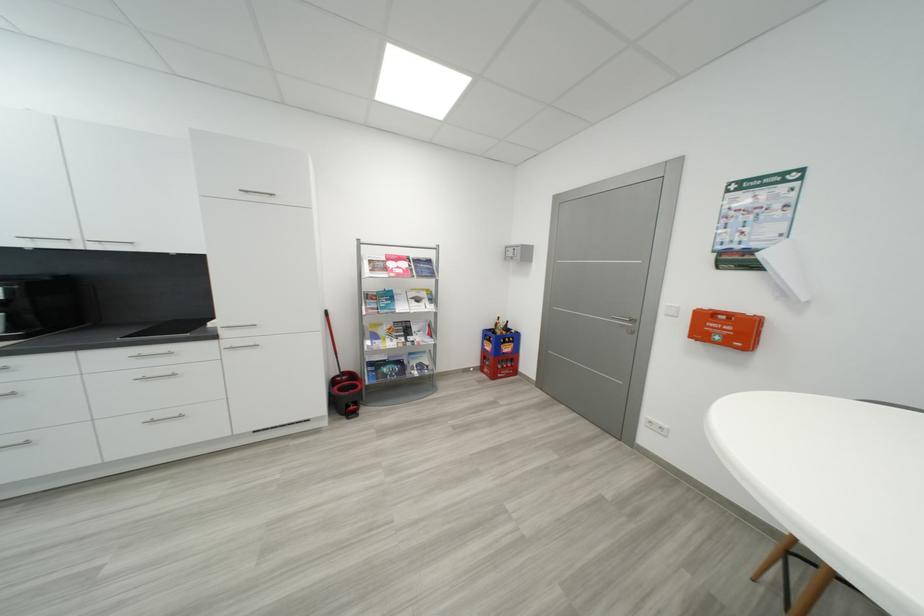
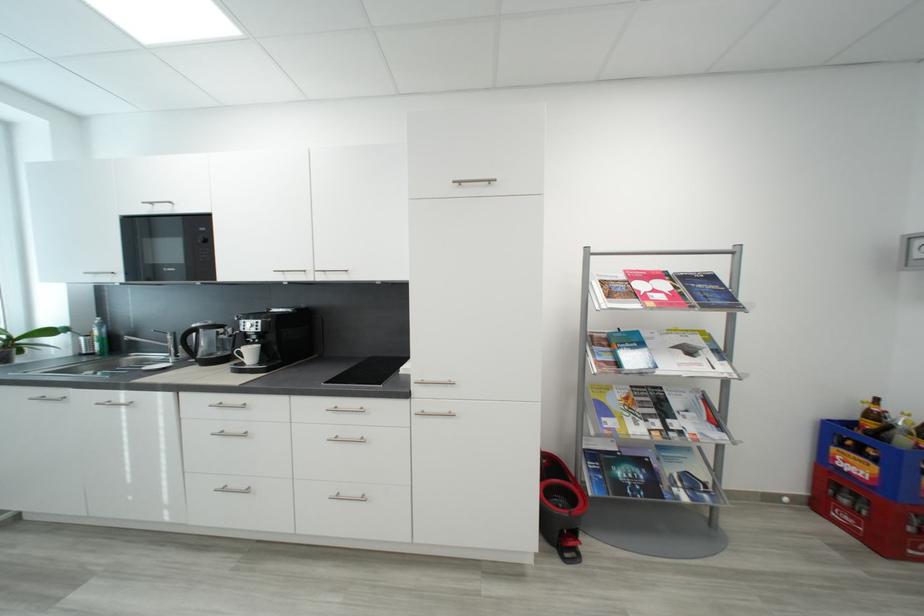
Question: I am providing you with two images of the same scene from different viewpoints. Please identify which objects are invisible in image2.

Choices:
 (A) black kettle handle
 (B) magazine on rack
 (C) mop bucket pedal
 (D) none of these

Answer: (D)